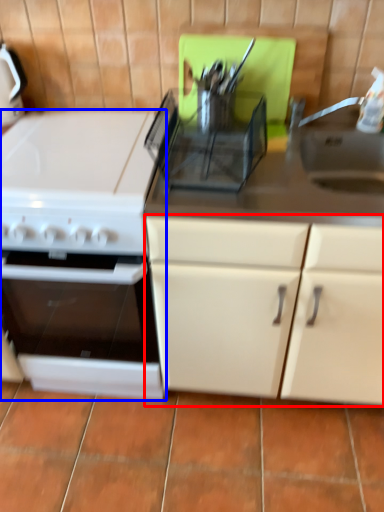
Question: Which of the following is the closest to the observer, cabinetry (highlighted by a red box) or kitchen appliance (highlighted by a blue box)?

Choices:
 (A) cabinetry
 (B) kitchen appliance

Answer: (A)